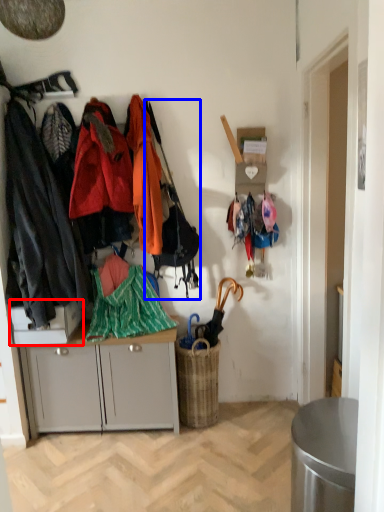
Question: Which object is further to the camera taking this photo, desk (highlighted by a red box) or handbag (highlighted by a blue box)?

Choices:
 (A) desk
 (B) handbag

Answer: (A)